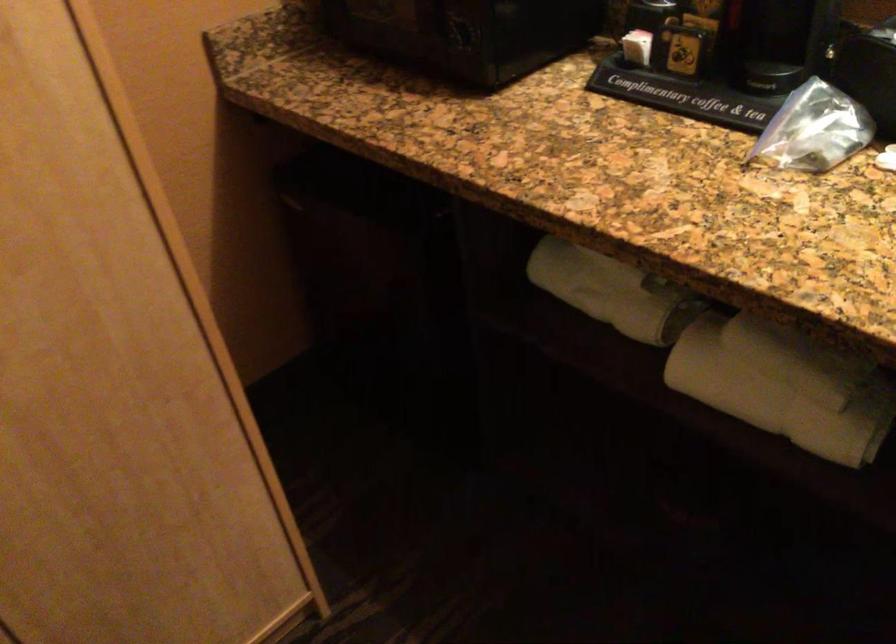
Locate an element on the screen. Image resolution: width=896 pixels, height=644 pixels. dark coffee pod is located at coordinates (466, 33).